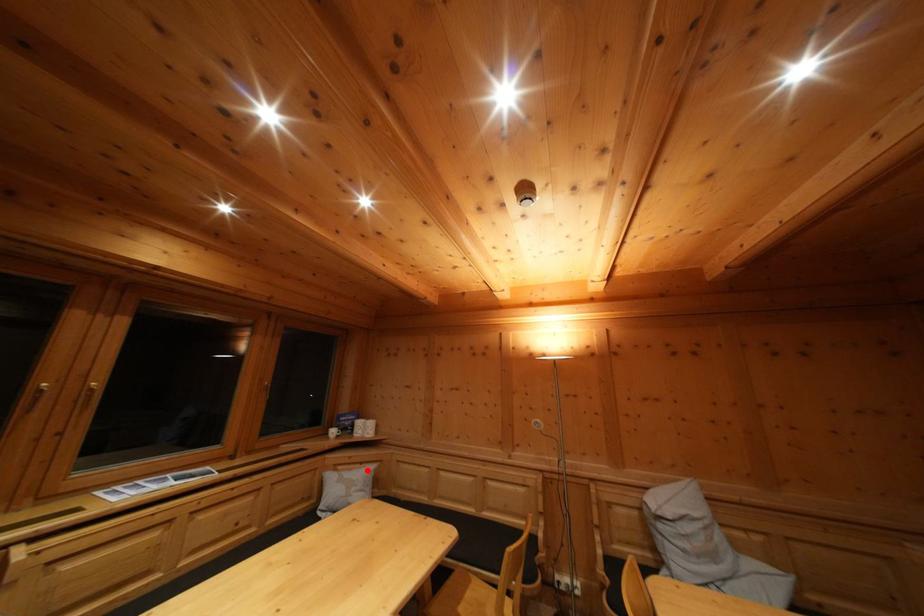
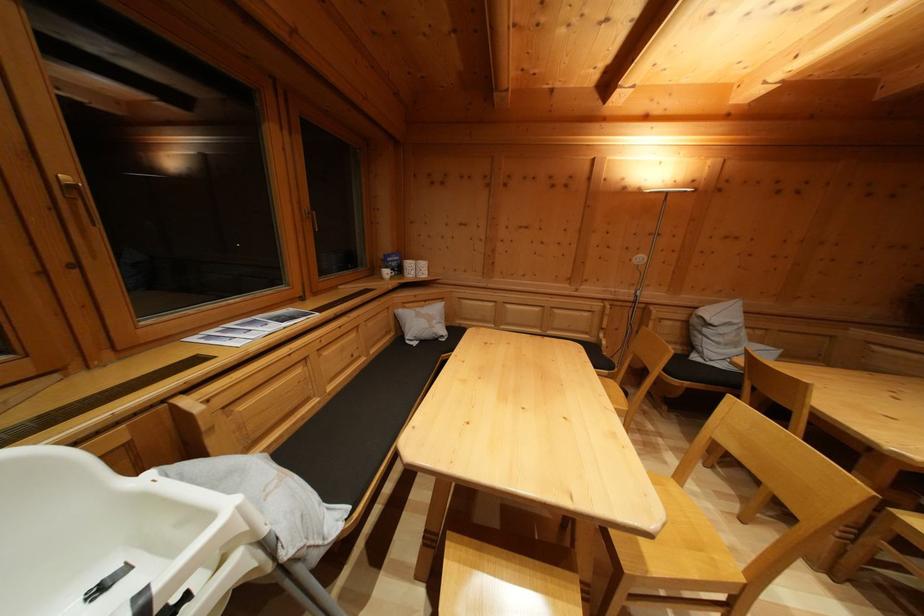
Question: I am providing you with two images of the same scene from different viewpoints. A red point is shown in image1. For the corresponding object point in image2, is it positioned nearer or farther from the camera?

Choices:
 (A) Nearer
 (B) Farther

Answer: (A)